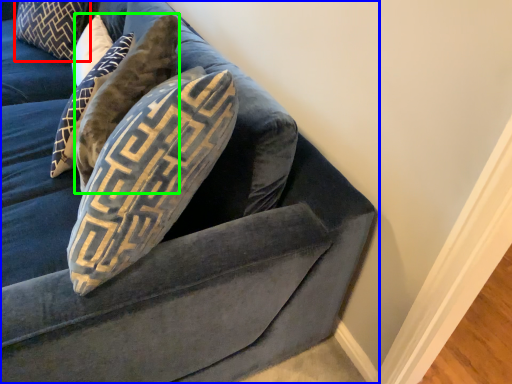
Question: Which object is positioned closest to pillow (highlighted by a red box)? Select from studio couch (highlighted by a blue box) and pillow (highlighted by a green box).

Choices:
 (A) studio couch
 (B) pillow

Answer: (B)